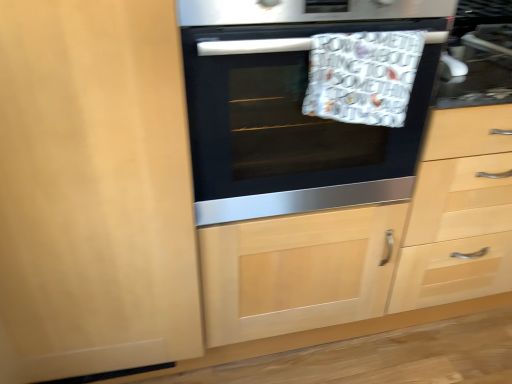
Question: Based on their sizes in the image, would you say black glass oven at center is bigger or smaller than matte wood dresser at center?

Choices:
 (A) big
 (B) small

Answer: (B)

Question: From the image's perspective, is black glass oven at center above or below matte wood dresser at center?

Choices:
 (A) below
 (B) above

Answer: (B)

Question: Considering the positions of black glass oven at center and matte wood dresser at center in the image, is black glass oven at center wider or thinner than matte wood dresser at center?

Choices:
 (A) thin
 (B) wide

Answer: (B)

Question: Considering the positions of point click(470, 192) and point click(199, 221), is point click(470, 192) closer or farther from the camera than point click(199, 221)?

Choices:
 (A) closer
 (B) farther

Answer: (B)

Question: Considering their positions, is matte wood dresser at center located in front of or behind black glass oven at center?

Choices:
 (A) behind
 (B) front

Answer: (A)

Question: From a real-world perspective, is matte wood dresser at center physically located above or below black glass oven at center?

Choices:
 (A) above
 (B) below

Answer: (B)

Question: Looking at their shapes, would you say matte wood dresser at center is wider or thinner than black glass oven at center?

Choices:
 (A) thin
 (B) wide

Answer: (A)